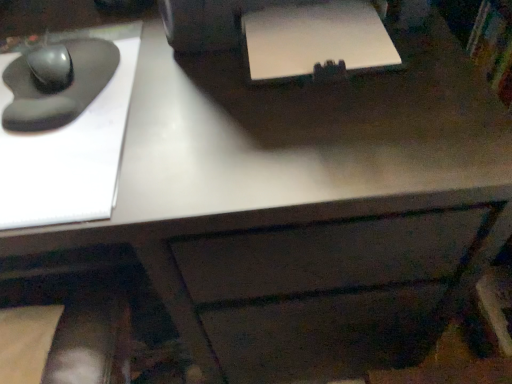
You are a GUI agent. You are given a task and a screenshot of the screen. Output one action in this format:
    pyautogui.click(x=<x>, y=<y>)
    Task: Click on the free location above white matte printer at upper center (from a real-world perspective)
    The image size is (512, 384).
    Given the screenshot: What is the action you would take?
    pyautogui.click(x=325, y=39)